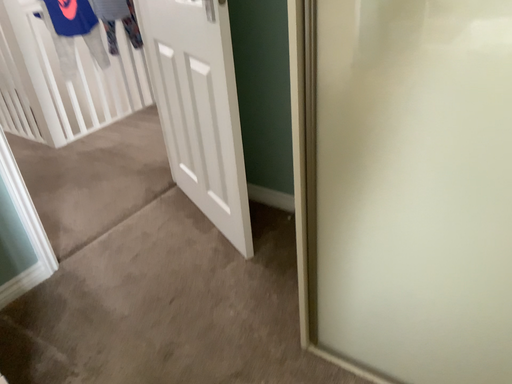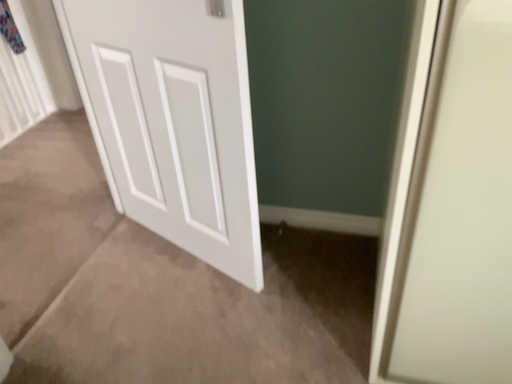
Question: How did the camera likely rotate when shooting the video?

Choices:
 (A) rotated right
 (B) rotated left

Answer: (A)